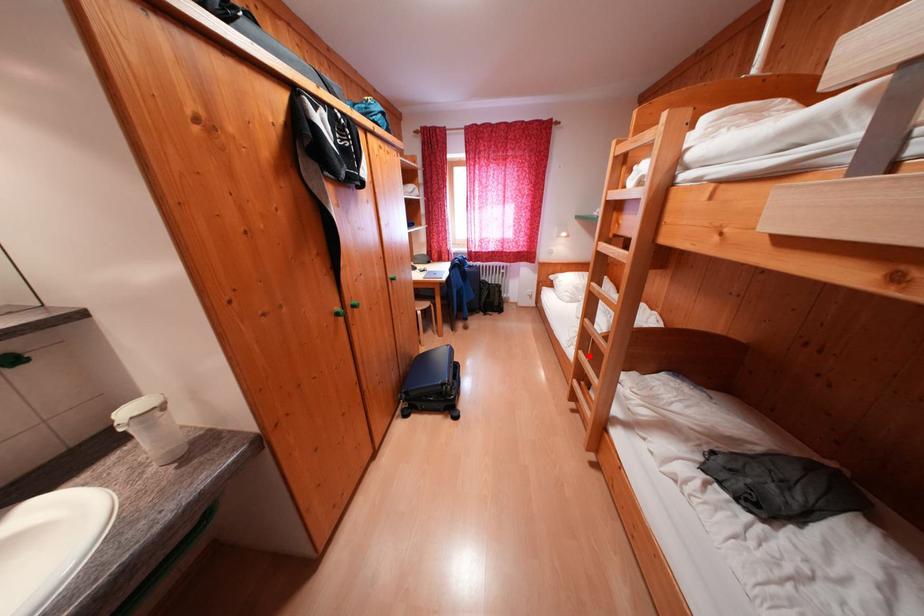
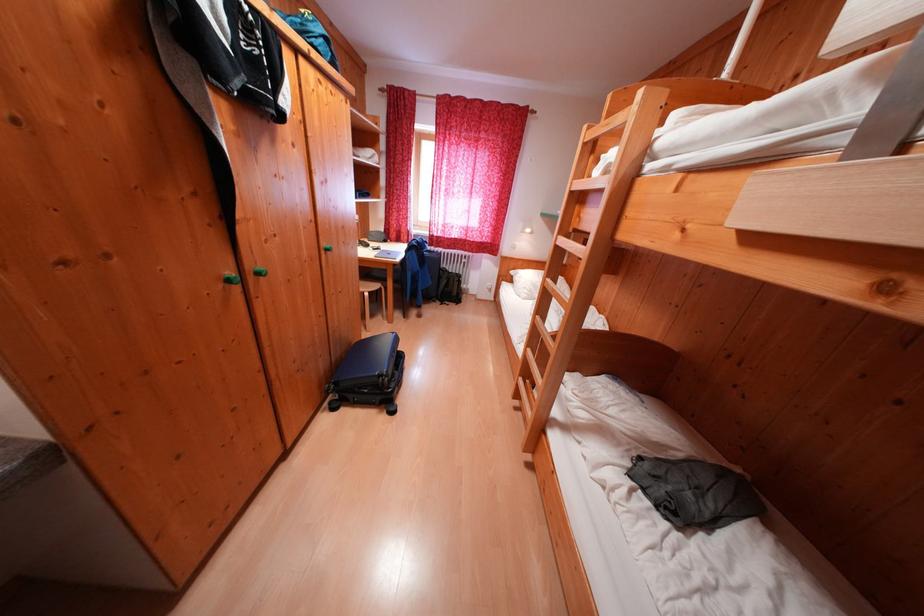
Find the pixel in the second image that matches the highlighted location in the first image.

(537, 354)